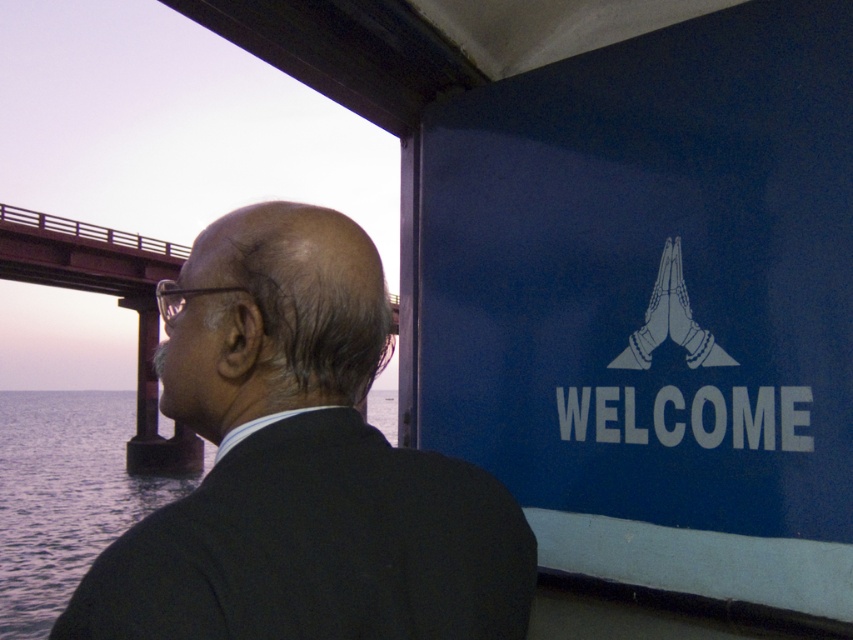
Who is positioned more to the left, dark blue water at left or rusty metal bridge at left?

From the viewer's perspective, dark blue water at left appears more on the left side.

Who is taller, dark blue water at left or rusty metal bridge at left?

With more height is rusty metal bridge at left.

The width and height of the screenshot is (853, 640). What do you see at coordinates (65, 497) in the screenshot?
I see `dark blue water at left` at bounding box center [65, 497].

At what (x,y) coordinates should I click in order to perform the action: click on dark blue water at left. Please return your answer as a coordinate pair (x, y). The height and width of the screenshot is (640, 853). Looking at the image, I should click on (65, 497).

Between black suit at center and dark blue water at left, which one appears on the right side from the viewer's perspective?

Positioned to the right is black suit at center.

Which is in front, point (343, 579) or point (395, 422)?

Point (343, 579)

Who is more forward, (x=289, y=620) or (x=109, y=540)?

Point (x=289, y=620) is in front.

The image size is (853, 640). What are the coordinates of `black suit at center` in the screenshot? It's located at (300, 465).

Who is positioned more to the left, black suit at center or rusty metal bridge at left?

From the viewer's perspective, rusty metal bridge at left appears more on the left side.

Which is behind, point (65, 625) or point (39, 268)?

The point (39, 268) is behind.

What do you see at coordinates (300, 465) in the screenshot? I see `black suit at center` at bounding box center [300, 465].

The height and width of the screenshot is (640, 853). I want to click on black suit at center, so click(x=300, y=465).